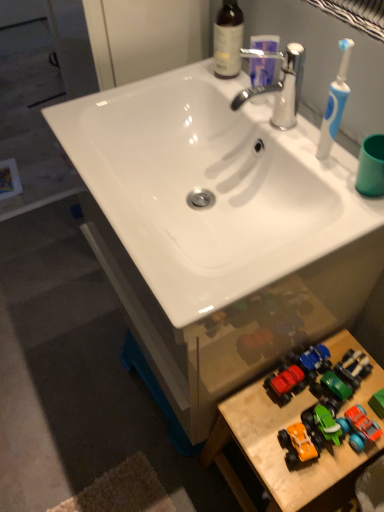
The width and height of the screenshot is (384, 512). In order to click on free location above wooden toy cars at lower right (from a real-world perspective) in this screenshot , I will do `click(316, 436)`.